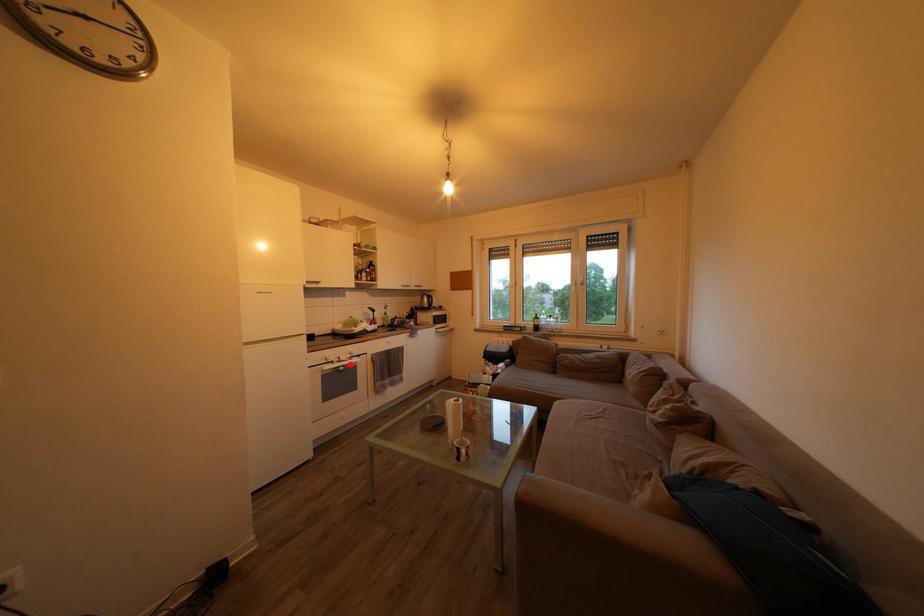
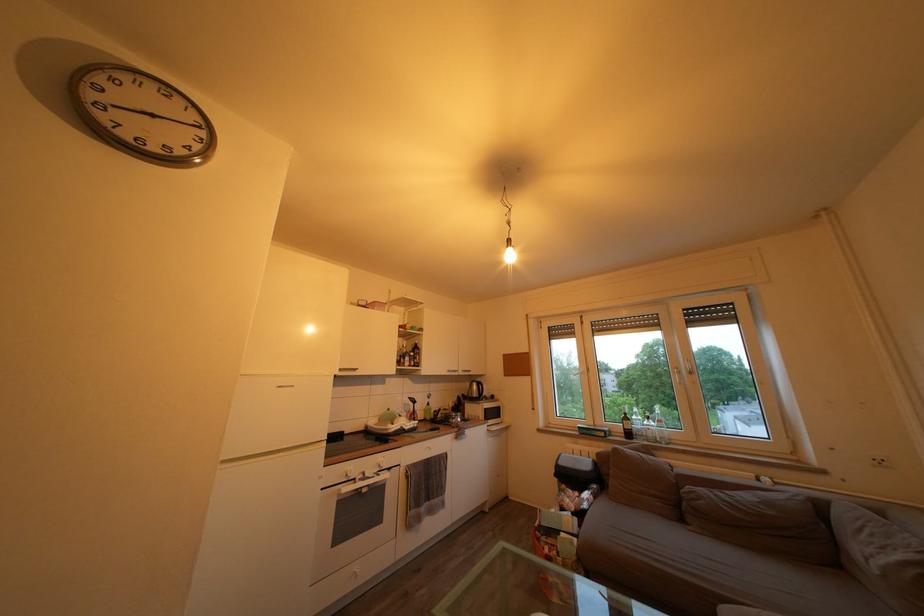
Where in the second image is the point corresponding to the highlighted location from the first image?

(375, 480)